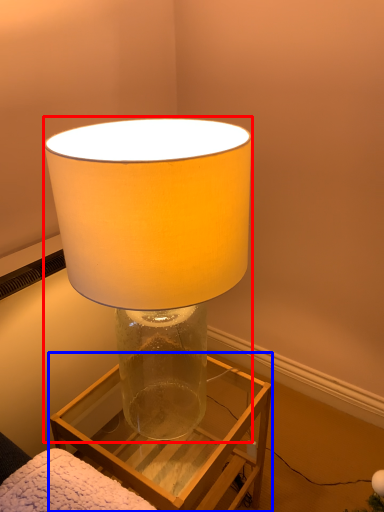
Question: Which object appears closest to the camera in this image, lamp (highlighted by a red box) or furniture (highlighted by a blue box)?

Choices:
 (A) lamp
 (B) furniture

Answer: (A)